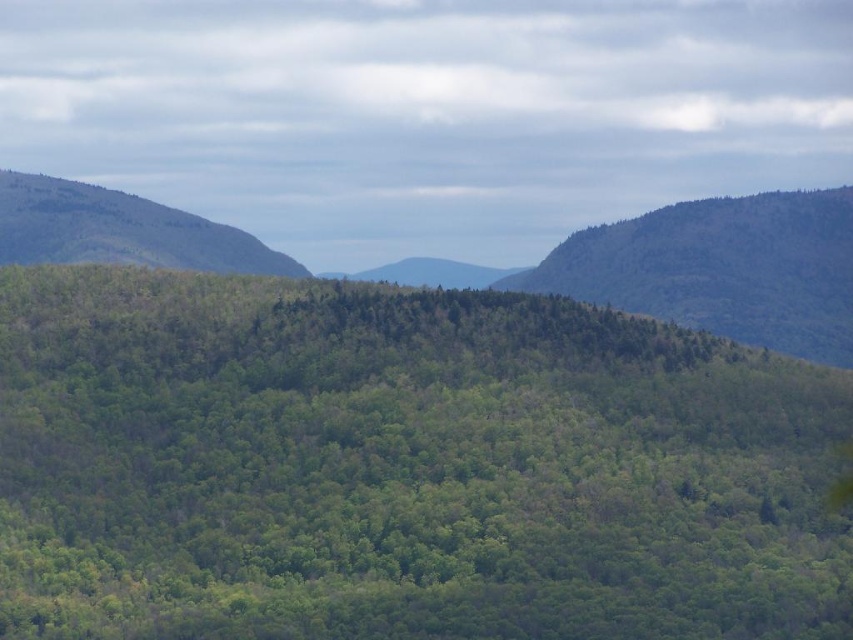
Question: Which point is closer to the camera?

Choices:
 (A) (206, 513)
 (B) (177, 252)

Answer: (A)

Question: Among these objects, which one is nearest to the camera?

Choices:
 (A) green forested mountain at center
 (B) green leafy hill at right

Answer: (B)

Question: Which of these objects is positioned closest to the green leafy forest at center?

Choices:
 (A) green leafy hillside at left
 (B) green forested mountain at center
 (C) green leafy hill at right

Answer: (C)

Question: Can you confirm if green leafy forest at center is thinner than green leafy hillside at left?

Choices:
 (A) no
 (B) yes

Answer: (A)

Question: Does green forested mountain at center appear on the right side of green leafy hill at right?

Choices:
 (A) yes
 (B) no

Answer: (B)

Question: Does green leafy hill at right have a larger size compared to green leafy hillside at left?

Choices:
 (A) no
 (B) yes

Answer: (B)